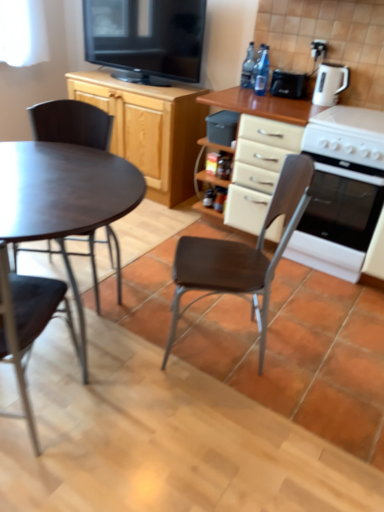
You are a GUI agent. You are given a task and a screenshot of the screen. Output one action in this format:
    pyautogui.click(x=<x>, y=<y>)
    Task: Click on the vacant space in front of black plastic toaster at upper right, which appears as the 1th appliance when viewed from the right
    This screenshot has width=384, height=512.
    Given the screenshot: What is the action you would take?
    pyautogui.click(x=294, y=97)